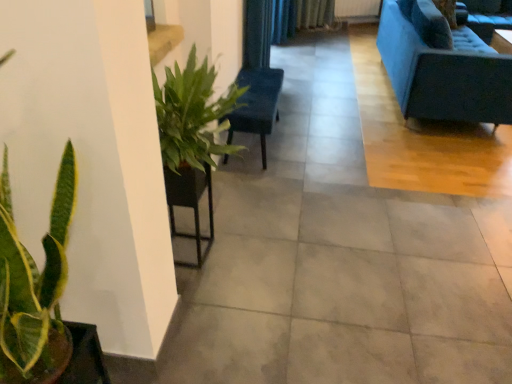
Question: Can you see black fabric curtain at upper center touching green glossy plant at lower left?

Choices:
 (A) no
 (B) yes

Answer: (A)

Question: Is black fabric curtain at upper center closer to the viewer compared to green glossy plant at lower left?

Choices:
 (A) yes
 (B) no

Answer: (B)

Question: Does black fabric curtain at upper center lie behind green glossy plant at lower left?

Choices:
 (A) yes
 (B) no

Answer: (A)

Question: Is green glossy plant at lower left located within black fabric curtain at upper center?

Choices:
 (A) no
 (B) yes

Answer: (A)

Question: Is black fabric curtain at upper center facing away from green glossy plant at lower left?

Choices:
 (A) yes
 (B) no

Answer: (B)

Question: Can you confirm if black fabric curtain at upper center is thinner than green glossy plant at lower left?

Choices:
 (A) yes
 (B) no

Answer: (A)

Question: Is matte brown flowerpot at lower left outside of velvet blue couch at upper right?

Choices:
 (A) yes
 (B) no

Answer: (A)

Question: Considering the relative sizes of matte brown flowerpot at lower left and velvet blue couch at upper right in the image provided, is matte brown flowerpot at lower left taller than velvet blue couch at upper right?

Choices:
 (A) yes
 (B) no

Answer: (B)

Question: Is matte brown flowerpot at lower left closer to the viewer compared to velvet blue couch at upper right?

Choices:
 (A) yes
 (B) no

Answer: (A)

Question: From a real-world perspective, is matte brown flowerpot at lower left beneath velvet blue couch at upper right?

Choices:
 (A) yes
 (B) no

Answer: (B)

Question: Does matte brown flowerpot at lower left turn towards velvet blue couch at upper right?

Choices:
 (A) yes
 (B) no

Answer: (B)

Question: Does matte brown flowerpot at lower left have a lesser width compared to velvet blue couch at upper right?

Choices:
 (A) yes
 (B) no

Answer: (A)

Question: From a real-world perspective, is matte brown flowerpot at lower left physically below green glossy plant at lower left?

Choices:
 (A) yes
 (B) no

Answer: (A)